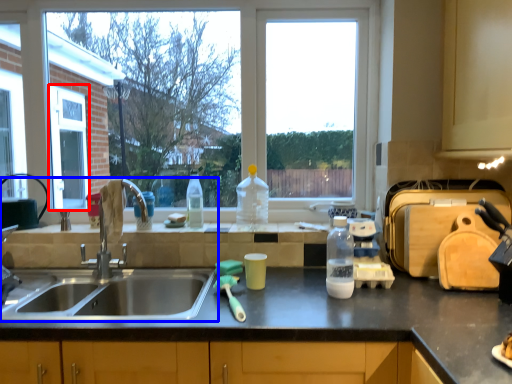
Question: Which point is further to the camera, screen door (highlighted by a red box) or sink (highlighted by a blue box)?

Choices:
 (A) screen door
 (B) sink

Answer: (A)